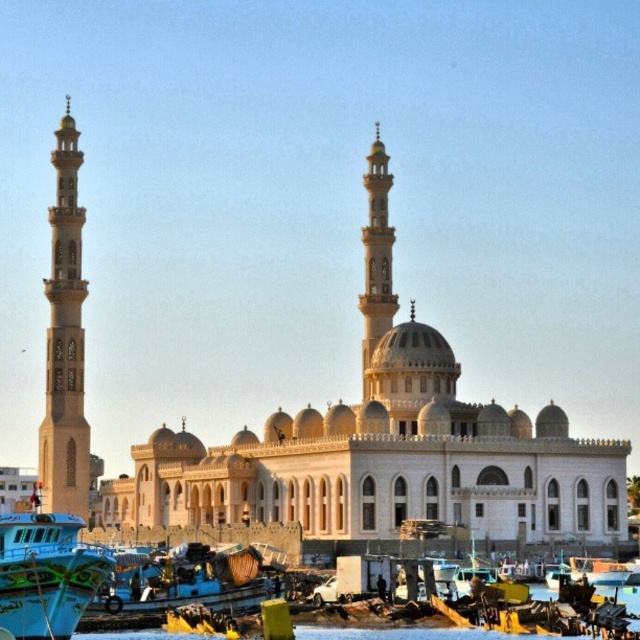
Question: Does blue painted wood boat at lower left have a larger size compared to beige stone minaret at center?

Choices:
 (A) no
 (B) yes

Answer: (A)

Question: Is beige stone minaret at left to the left of beige stone minaret at center from the viewer's perspective?

Choices:
 (A) no
 (B) yes

Answer: (B)

Question: Among these objects, which one is nearest to the camera?

Choices:
 (A) blue painted wooden boat at lower left
 (B) beige stone minaret at center
 (C) beige stone minaret at left

Answer: (A)

Question: Which object is positioned closest to the blue painted wood boat at lower left?

Choices:
 (A) beige stone minaret at center
 (B) clear water at lower center
 (C) blue painted wooden boat at lower left

Answer: (B)

Question: Is blue painted wooden boat at lower left to the left of clear water at lower center from the viewer's perspective?

Choices:
 (A) no
 (B) yes

Answer: (B)

Question: Which object appears farthest from the camera in this image?

Choices:
 (A) blue painted wooden boat at lower left
 (B) beige stone minaret at left
 (C) blue painted wood boat at lower left
 (D) clear water at lower center

Answer: (B)